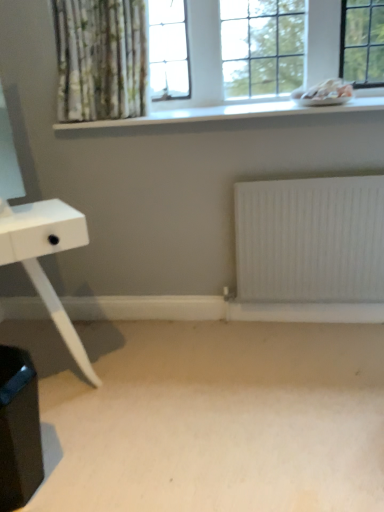
Locate an element on the screen. free location above beige carpet at lower center (from a real-world perspective) is located at coordinates (201, 391).